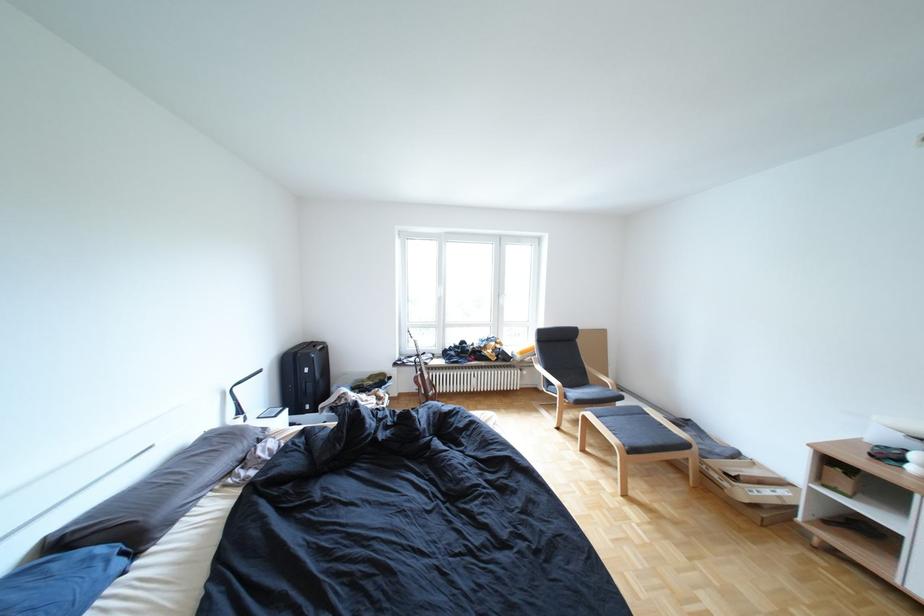
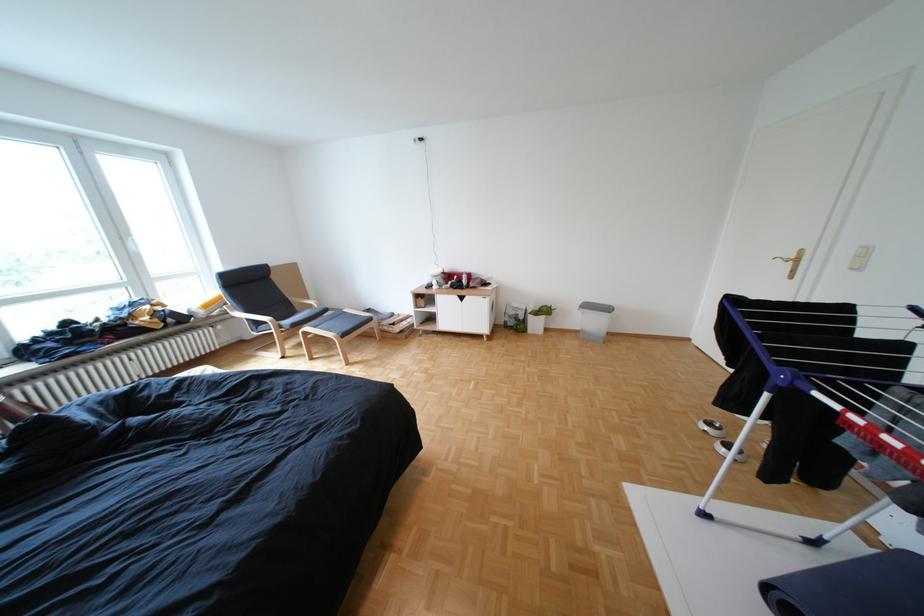
Locate, in the second image, the point that corresponds to the point at 602,367 in the first image.

(306, 299)